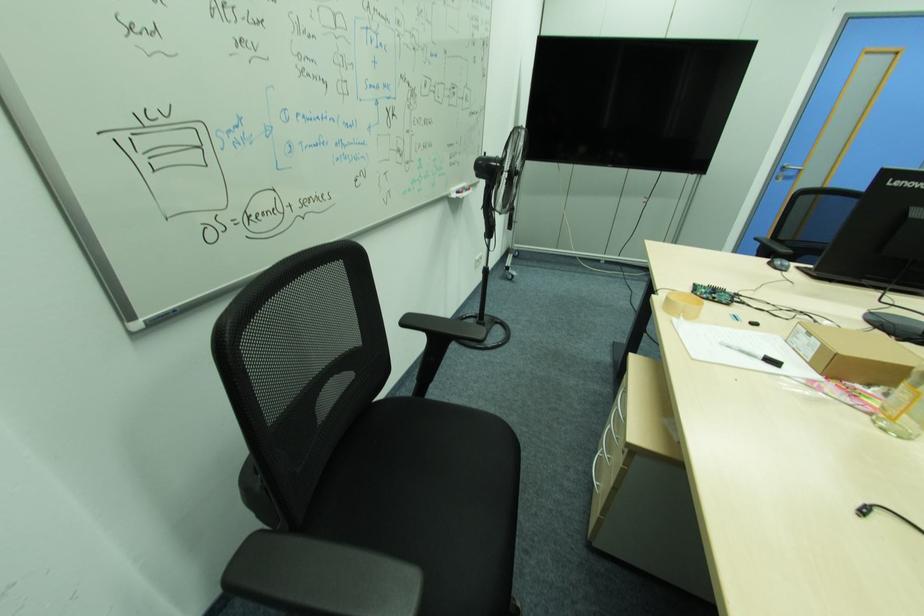
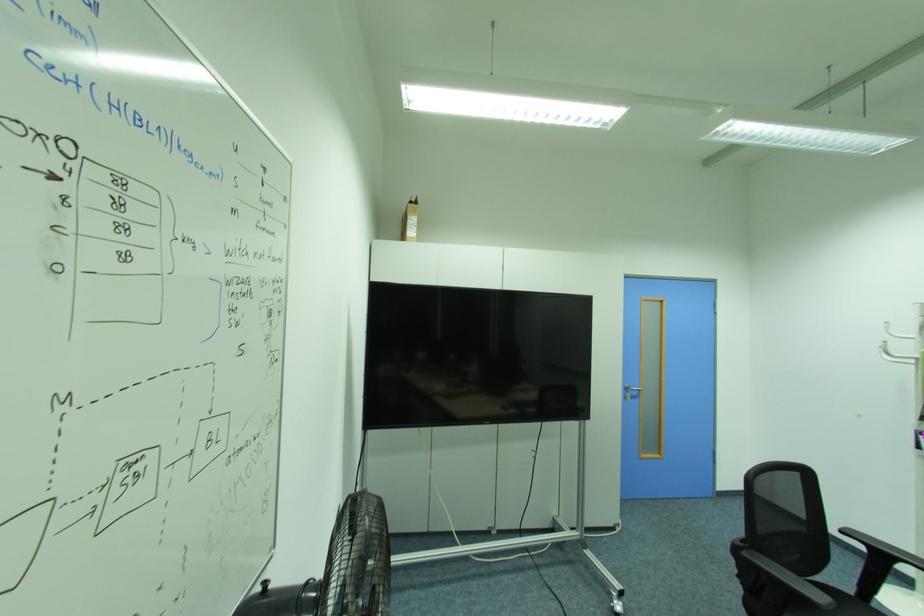
Find the pixel in the second image that matches (x=784, y=171) in the first image.

(629, 390)